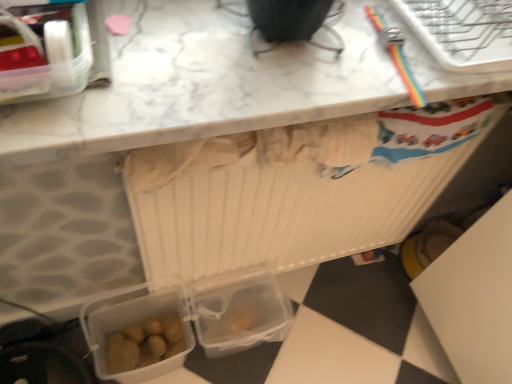
Measure the distance between transparent plastic lunch box at lower center, arranged as the first lunch box when viewed from the back, and camera.

transparent plastic lunch box at lower center, arranged as the first lunch box when viewed from the back, is 3.42 feet away from camera.

Where is `white marble countertop at upper center`? white marble countertop at upper center is located at coordinates [223, 83].

Locate an element on the screen. translucent plastic lunch box at upper left, the 3th lunch box from the back is located at coordinates (45, 51).

What is the approximate width of rainbow plastic bracelet at upper right?

rainbow plastic bracelet at upper right is 11.60 inches wide.

Measure the distance between rainbow plastic bracelet at upper right and camera.

They are 25.57 inches apart.

You are a GUI agent. You are given a task and a screenshot of the screen. Output one action in this format:
    pyautogui.click(x=<x>, y=<y>)
    Task: Click on the transparent plastic lunch box at lower center, which is the second lunch box in top-to-bottom order
    The width and height of the screenshot is (512, 384).
    Given the screenshot: What is the action you would take?
    pyautogui.click(x=239, y=311)

In the scene shown: In the image, is rainbow plastic bracelet at upper right positioned in front of or behind white marble countertop at upper center?

Clearly, rainbow plastic bracelet at upper right is behind white marble countertop at upper center.

Does rainbow plastic bracelet at upper right have a smaller size compared to white marble countertop at upper center?

Indeed, rainbow plastic bracelet at upper right has a smaller size compared to white marble countertop at upper center.

In the image, is rainbow plastic bracelet at upper right on the left side or the right side of white marble countertop at upper center?

rainbow plastic bracelet at upper right is to the right of white marble countertop at upper center.

From the image's perspective, is white marble countertop at upper center located beneath transparent plastic lunch box at lower center, which is the second lunch box in top-to-bottom order?

No.

From the picture: Considering the sizes of white marble countertop at upper center and transparent plastic lunch box at lower center, arranged as the first lunch box when viewed from the back, in the image, is white marble countertop at upper center wider or thinner than transparent plastic lunch box at lower center, arranged as the first lunch box when viewed from the back,?

white marble countertop at upper center is wider than transparent plastic lunch box at lower center, arranged as the first lunch box when viewed from the back.

From a real-world perspective, who is located lower, white marble countertop at upper center or transparent plastic lunch box at lower center, positioned as the 2th lunch box in bottom-to-top order?

transparent plastic lunch box at lower center, positioned as the 2th lunch box in bottom-to-top order.

Is white marble countertop at upper center oriented away from transparent plastic lunch box at lower center, which is the second lunch box in top-to-bottom order?

No, white marble countertop at upper center is not facing the opposite direction of transparent plastic lunch box at lower center, which is the second lunch box in top-to-bottom order.

Considering the positions of objects rainbow plastic bracelet at upper right and transparent plastic lunch box at lower center, positioned as the 2th lunch box in bottom-to-top order, in the image provided, who is more to the left, rainbow plastic bracelet at upper right or transparent plastic lunch box at lower center, positioned as the 2th lunch box in bottom-to-top order,?

transparent plastic lunch box at lower center, positioned as the 2th lunch box in bottom-to-top order, is more to the left.

From a real-world perspective, between rainbow plastic bracelet at upper right and transparent plastic lunch box at lower center, arranged as the first lunch box when viewed from the back, who is vertically lower?

transparent plastic lunch box at lower center, arranged as the first lunch box when viewed from the back, from a real-world perspective.

Is rainbow plastic bracelet at upper right placed right next to transparent plastic lunch box at lower center, which is the second lunch box in top-to-bottom order?

No, rainbow plastic bracelet at upper right is not touching transparent plastic lunch box at lower center, which is the second lunch box in top-to-bottom order.

Which of these two, rainbow plastic bracelet at upper right or transparent plastic lunch box at lower center, placed as the third lunch box when sorted from front to back, is smaller?

rainbow plastic bracelet at upper right is smaller.

Looking at this image, from the image's perspective, who appears lower, translucent plastic lunch box at lower left, the 2th lunch box positioned from the front, or transparent plastic lunch box at lower center, placed as the third lunch box when sorted from front to back?

translucent plastic lunch box at lower left, the 2th lunch box positioned from the front, from the image's perspective.

From a real-world perspective, which is physically below, translucent plastic lunch box at lower left, which is counted as the third lunch box, starting from the top, or transparent plastic lunch box at lower center, placed as the third lunch box when sorted from front to back?

transparent plastic lunch box at lower center, placed as the third lunch box when sorted from front to back, from a real-world perspective.

Between translucent plastic lunch box at lower left, the 2th lunch box positioned from the front, and transparent plastic lunch box at lower center, placed as the third lunch box when sorted from front to back, which one has less height?

transparent plastic lunch box at lower center, placed as the third lunch box when sorted from front to back.

Considering the positions of objects translucent plastic lunch box at lower left, the 2th lunch box when ordered from back to front, and transparent plastic lunch box at lower center, positioned as the 2th lunch box in bottom-to-top order, in the image provided, who is more to the left, translucent plastic lunch box at lower left, the 2th lunch box when ordered from back to front, or transparent plastic lunch box at lower center, positioned as the 2th lunch box in bottom-to-top order,?

Positioned to the left is translucent plastic lunch box at lower left, the 2th lunch box when ordered from back to front.

Is the position of translucent plastic lunch box at lower left, the first lunch box positioned from the bottom, less distant than that of translucent plastic lunch box at upper left, which is counted as the first lunch box, starting from the top?

No, translucent plastic lunch box at lower left, the first lunch box positioned from the bottom, is further to the viewer.

Looking at the image, does translucent plastic lunch box at lower left, the 2th lunch box positioned from the front, seem bigger or smaller compared to translucent plastic lunch box at upper left, the 3th lunch box from the back?

Clearly, translucent plastic lunch box at lower left, the 2th lunch box positioned from the front, is larger in size than translucent plastic lunch box at upper left, the 3th lunch box from the back.

Is translucent plastic lunch box at lower left, the 2th lunch box positioned from the front, turned away from translucent plastic lunch box at upper left, arranged as the 1th lunch box when viewed from the front?

No.

How distant is transparent plastic lunch box at lower center, arranged as the first lunch box when viewed from the back, from translucent plastic lunch box at upper left, arranged as the 1th lunch box when viewed from the front?

29.04 inches.

Is transparent plastic lunch box at lower center, arranged as the first lunch box when viewed from the back, facing towards translucent plastic lunch box at upper left, the 3th lunch box from the back?

No, transparent plastic lunch box at lower center, arranged as the first lunch box when viewed from the back, is not oriented towards translucent plastic lunch box at upper left, the 3th lunch box from the back.

Is translucent plastic lunch box at upper left, arranged as the 1th lunch box when viewed from the front, inside transparent plastic lunch box at lower center, which is the second lunch box in top-to-bottom order?

That's incorrect, translucent plastic lunch box at upper left, arranged as the 1th lunch box when viewed from the front, is not inside transparent plastic lunch box at lower center, which is the second lunch box in top-to-bottom order.

Can you tell me how much transparent plastic lunch box at lower center, which is the second lunch box in top-to-bottom order, and translucent plastic lunch box at upper left, which is counted as the first lunch box, starting from the top, differ in facing direction?

The angular difference between transparent plastic lunch box at lower center, which is the second lunch box in top-to-bottom order, and translucent plastic lunch box at upper left, which is counted as the first lunch box, starting from the top, is 5.13 degrees.

Is the surface of transparent plastic lunch box at lower center, which is the second lunch box in top-to-bottom order, in direct contact with translucent plastic lunch box at lower left, the first lunch box positioned from the bottom?

transparent plastic lunch box at lower center, which is the second lunch box in top-to-bottom order, is not next to translucent plastic lunch box at lower left, the first lunch box positioned from the bottom, and they're not touching.

What's the angular difference between transparent plastic lunch box at lower center, positioned as the 2th lunch box in bottom-to-top order, and translucent plastic lunch box at lower left, the 2th lunch box when ordered from back to front,'s facing directions?

The facing directions of transparent plastic lunch box at lower center, positioned as the 2th lunch box in bottom-to-top order, and translucent plastic lunch box at lower left, the 2th lunch box when ordered from back to front, are 1.32 degrees apart.

How distant is transparent plastic lunch box at lower center, which is the second lunch box in top-to-bottom order, from translucent plastic lunch box at lower left, which is counted as the third lunch box, starting from the top?

transparent plastic lunch box at lower center, which is the second lunch box in top-to-bottom order, is 5.92 inches from translucent plastic lunch box at lower left, which is counted as the third lunch box, starting from the top.

From the image's perspective, is transparent plastic lunch box at lower center, positioned as the 2th lunch box in bottom-to-top order, over translucent plastic lunch box at lower left, the 2th lunch box when ordered from back to front?

Correct, transparent plastic lunch box at lower center, positioned as the 2th lunch box in bottom-to-top order, appears higher than translucent plastic lunch box at lower left, the 2th lunch box when ordered from back to front, in the image.

Locate an element on the screen. countertop that is under the rainbow plastic bracelet at upper right (from a real-world perspective) is located at coordinates (223, 83).

Locate an element on the screen. The height and width of the screenshot is (384, 512). countertop located above the transparent plastic lunch box at lower center, placed as the third lunch box when sorted from front to back (from a real-world perspective) is located at coordinates (223, 83).

Considering their positions, is transparent plastic lunch box at lower center, positioned as the 2th lunch box in bottom-to-top order, positioned closer to translucent plastic lunch box at upper left, which is counted as the first lunch box, starting from the top, than translucent plastic lunch box at lower left, the 2th lunch box when ordered from back to front?

The object closer to translucent plastic lunch box at upper left, which is counted as the first lunch box, starting from the top, is translucent plastic lunch box at lower left, the 2th lunch box when ordered from back to front.

Based on the photo, considering their positions, is translucent plastic lunch box at lower left, the first lunch box positioned from the bottom, positioned closer to white marble countertop at upper center than rainbow plastic bracelet at upper right?

Among the two, rainbow plastic bracelet at upper right is located nearer to white marble countertop at upper center.

Considering their positions, is translucent plastic lunch box at upper left, arranged as the 1th lunch box when viewed from the front, positioned closer to transparent plastic lunch box at lower center, placed as the third lunch box when sorted from front to back, than translucent plastic lunch box at lower left, the 2th lunch box positioned from the front?

translucent plastic lunch box at lower left, the 2th lunch box positioned from the front, lies closer to transparent plastic lunch box at lower center, placed as the third lunch box when sorted from front to back, than the other object.

From the image, which object appears to be nearer to transparent plastic lunch box at lower center, positioned as the 2th lunch box in bottom-to-top order, white marble countertop at upper center or translucent plastic lunch box at upper left, which is counted as the first lunch box, starting from the top?

white marble countertop at upper center is closer to transparent plastic lunch box at lower center, positioned as the 2th lunch box in bottom-to-top order.

Considering their positions, is rainbow plastic bracelet at upper right positioned closer to white marble countertop at upper center than translucent plastic lunch box at lower left, the first lunch box positioned from the bottom?

rainbow plastic bracelet at upper right lies closer to white marble countertop at upper center than the other object.

When comparing their distances from translucent plastic lunch box at upper left, arranged as the 1th lunch box when viewed from the front, does rainbow plastic bracelet at upper right or translucent plastic lunch box at lower left, the 2th lunch box positioned from the front, seem closer?

Based on the image, rainbow plastic bracelet at upper right appears to be nearer to translucent plastic lunch box at upper left, arranged as the 1th lunch box when viewed from the front.

From the image, which object appears to be farther from white marble countertop at upper center, translucent plastic lunch box at upper left, the 3th lunch box ordered from the bottom, or translucent plastic lunch box at lower left, the first lunch box positioned from the bottom?

translucent plastic lunch box at lower left, the first lunch box positioned from the bottom.

From the image, which object appears to be farther from rainbow plastic bracelet at upper right, translucent plastic lunch box at upper left, arranged as the 1th lunch box when viewed from the front, or translucent plastic lunch box at lower left, the 2th lunch box when ordered from back to front?

Among the two, translucent plastic lunch box at lower left, the 2th lunch box when ordered from back to front, is located further to rainbow plastic bracelet at upper right.

Where is `countertop situated between translucent plastic lunch box at upper left, arranged as the 1th lunch box when viewed from the front, and rainbow plastic bracelet at upper right from left to right`? This screenshot has width=512, height=384. countertop situated between translucent plastic lunch box at upper left, arranged as the 1th lunch box when viewed from the front, and rainbow plastic bracelet at upper right from left to right is located at coordinates (223, 83).

You are a GUI agent. You are given a task and a screenshot of the screen. Output one action in this format:
    pyautogui.click(x=<x>, y=<y>)
    Task: Click on the lunch box between white marble countertop at upper center and transparent plastic lunch box at lower center, positioned as the 2th lunch box in bottom-to-top order, in the up-down direction
    The width and height of the screenshot is (512, 384).
    Given the screenshot: What is the action you would take?
    (x=45, y=51)

In order to click on tool between white marble countertop at upper center and transparent plastic lunch box at lower center, placed as the third lunch box when sorted from front to back, vertically in this screenshot , I will do `click(396, 54)`.

You are a GUI agent. You are given a task and a screenshot of the screen. Output one action in this format:
    pyautogui.click(x=<x>, y=<y>)
    Task: Click on the tool between white marble countertop at upper center and translucent plastic lunch box at lower left, the first lunch box positioned from the bottom, vertically
    The width and height of the screenshot is (512, 384).
    Given the screenshot: What is the action you would take?
    pyautogui.click(x=396, y=54)